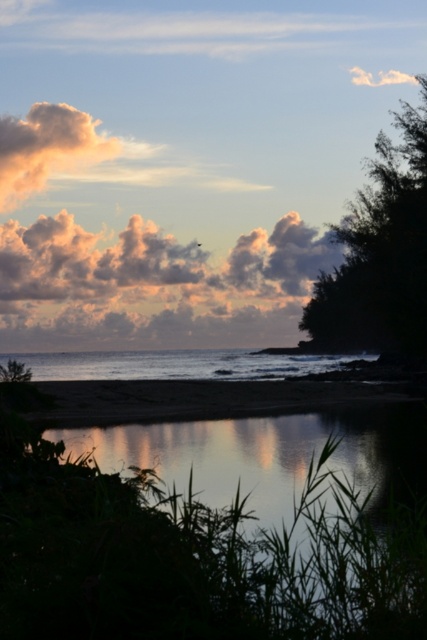
Is sandy shore at lower center below cloudy cotton cloud at upper left?

Correct, sandy shore at lower center is located below cloudy cotton cloud at upper left.

Is point (160, 404) positioned after point (111, 140)?

No, (160, 404) is in front of (111, 140).

Describe the element at coordinates (184, 397) in the screenshot. I see `sandy shore at lower center` at that location.

Locate an element on the screen. This screenshot has height=640, width=427. sandy shore at lower center is located at coordinates (184, 397).

Does cloudy cotton cloud at upper left appear over cloudy cotton cloud at center?

Correct, cloudy cotton cloud at upper left is located above cloudy cotton cloud at center.

Between cloudy cotton cloud at upper left and cloudy cotton cloud at center, which one has more height?

With more height is cloudy cotton cloud at upper left.

This screenshot has height=640, width=427. I want to click on cloudy cotton cloud at upper left, so click(46, 147).

Image resolution: width=427 pixels, height=640 pixels. Identify the location of silvery reflective water at lower center. (272, 452).

Does silvery reflective water at lower center have a lesser width compared to green leafy tree at right?

No.

Is point (201, 460) positioned after point (409, 164)?

No, it is not.

Find the location of `silvery reflective water at lower center`. silvery reflective water at lower center is located at coordinates (272, 452).